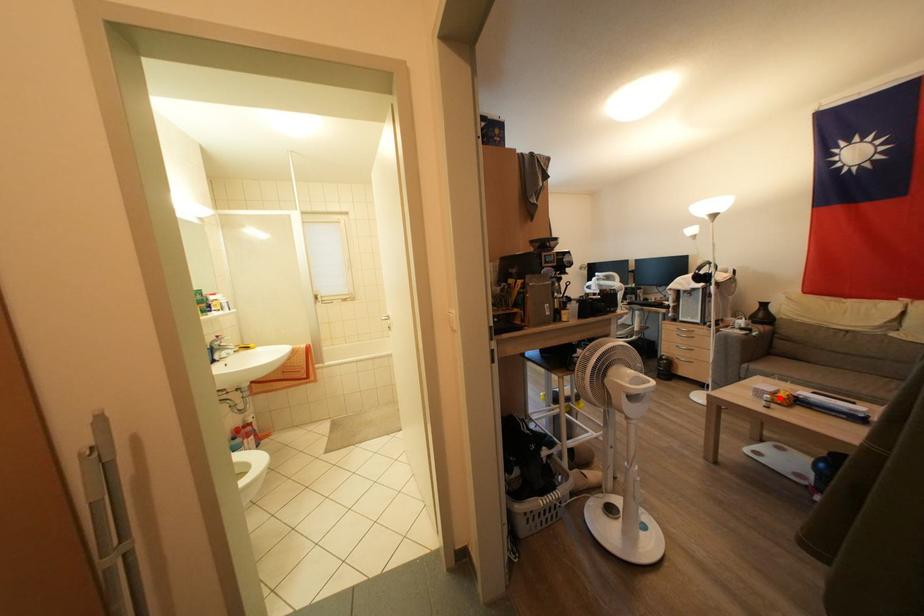
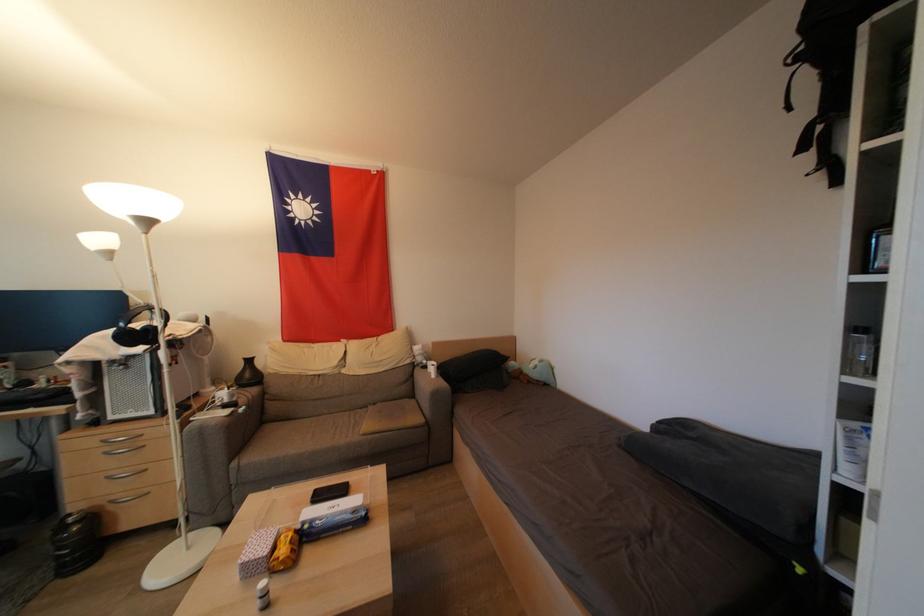
In the second image, find the point that corresponds to the highlighted location in the first image.

(277, 553)